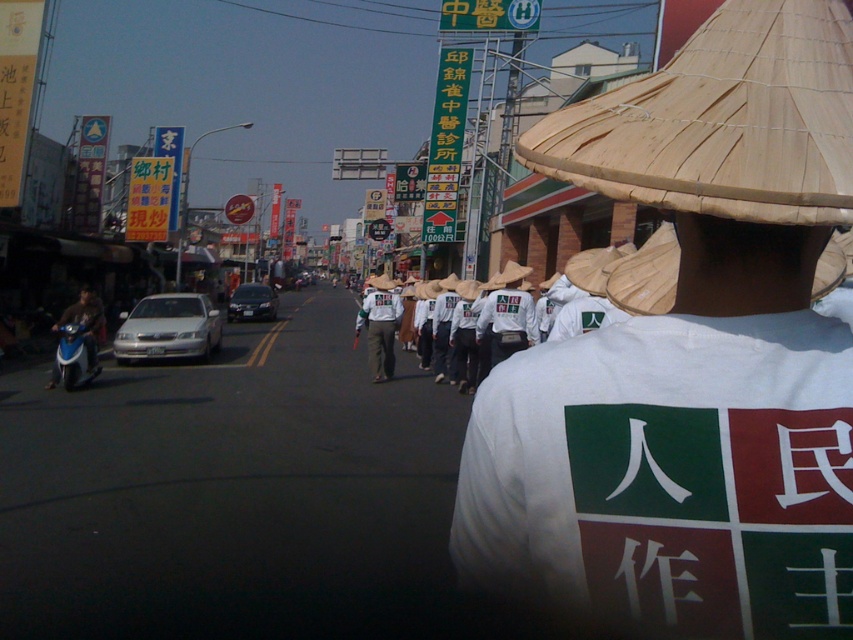
Question: Among these points, which one is farthest from the camera?

Choices:
 (A) (579, 445)
 (B) (79, 291)
 (C) (378, 300)

Answer: (B)

Question: Estimate the real-world distances between objects in this image. Which object is farther from the black matte helmet at center?

Choices:
 (A) white cotton shirt at center
 (B) white matte shirt at center

Answer: (A)

Question: Does white matte shirt at center have a lesser width compared to black matte helmet at center?

Choices:
 (A) yes
 (B) no

Answer: (A)

Question: Estimate the real-world distances between objects in this image. Which object is farther from the white matte shirt at center?

Choices:
 (A) black matte helmet at center
 (B) white cotton shirt at center

Answer: (A)

Question: Is white straw hat at center below black matte helmet at center?

Choices:
 (A) no
 (B) yes

Answer: (B)

Question: Is white straw hat at center further to camera compared to white matte shirt at center?

Choices:
 (A) no
 (B) yes

Answer: (A)